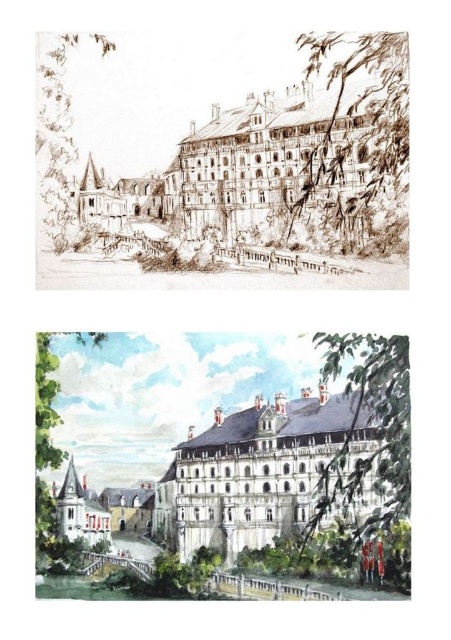
Looking at this image, does white paper building at center have a smaller size compared to white stone palace at center?

Actually, white paper building at center might be larger than white stone palace at center.

What do you see at coordinates (211, 467) in the screenshot?
I see `white paper building at center` at bounding box center [211, 467].

Who is more forward, (381, 504) or (192, 493)?

Point (381, 504)

The image size is (451, 640). Find the location of `white paper building at center`. white paper building at center is located at coordinates (211, 467).